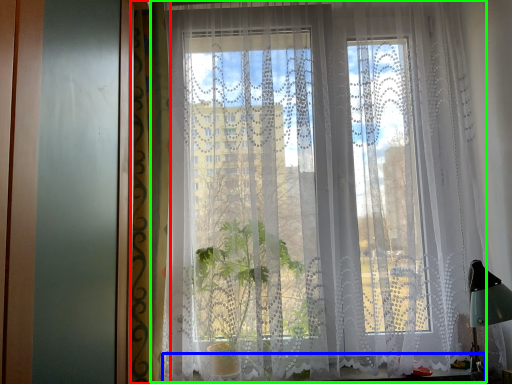
Question: Estimate the real-world distances between objects in this image. Which object is closer to curtain (highlighted by a red box), window sill (highlighted by a blue box) or curtain (highlighted by a green box)?

Choices:
 (A) window sill
 (B) curtain

Answer: (B)